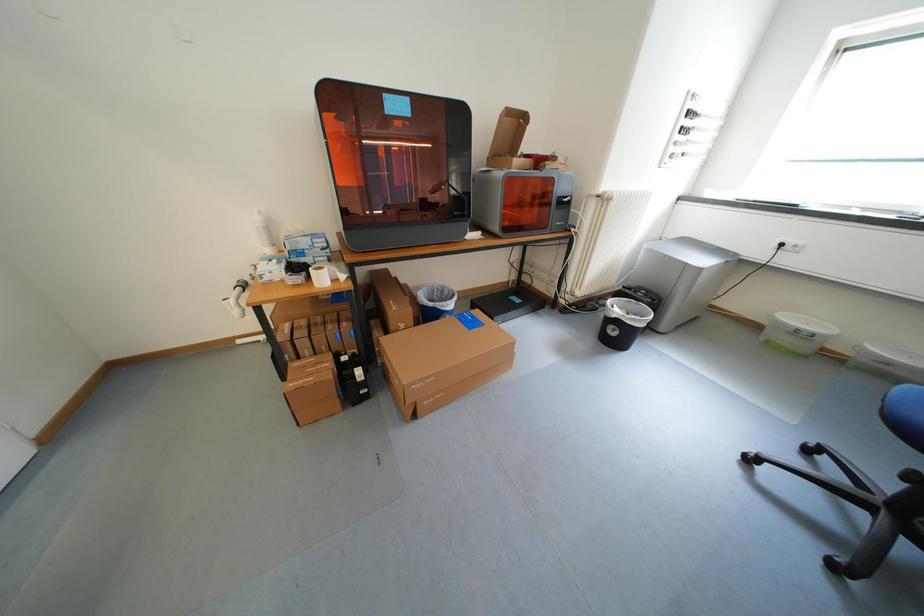
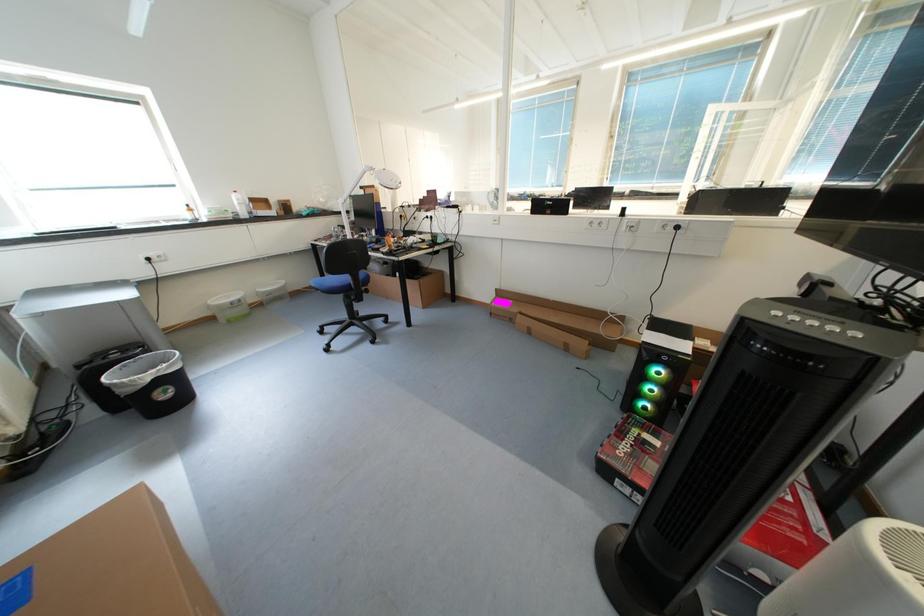
Based on the continuous images, in which direction is the camera rotating?

The rotation direction of the camera is right-down.